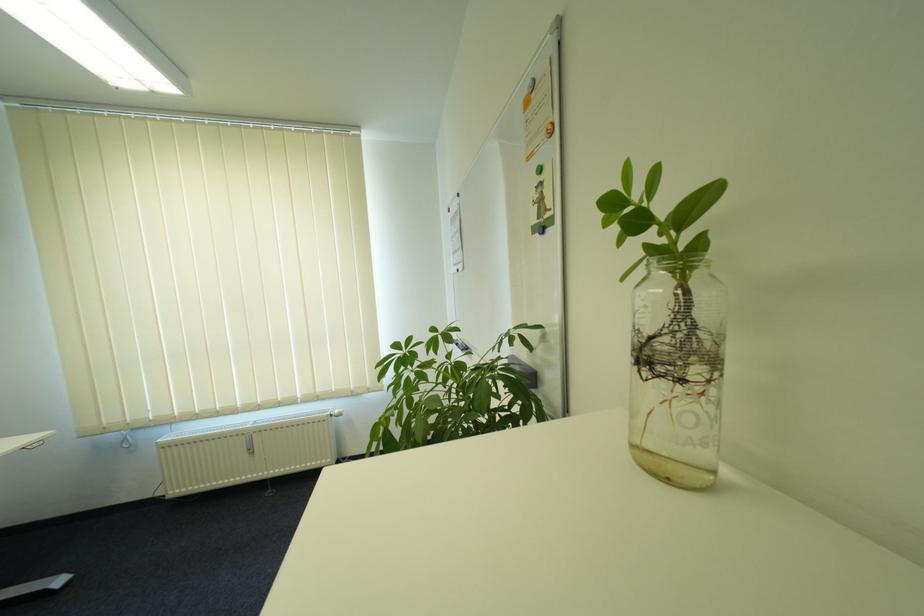
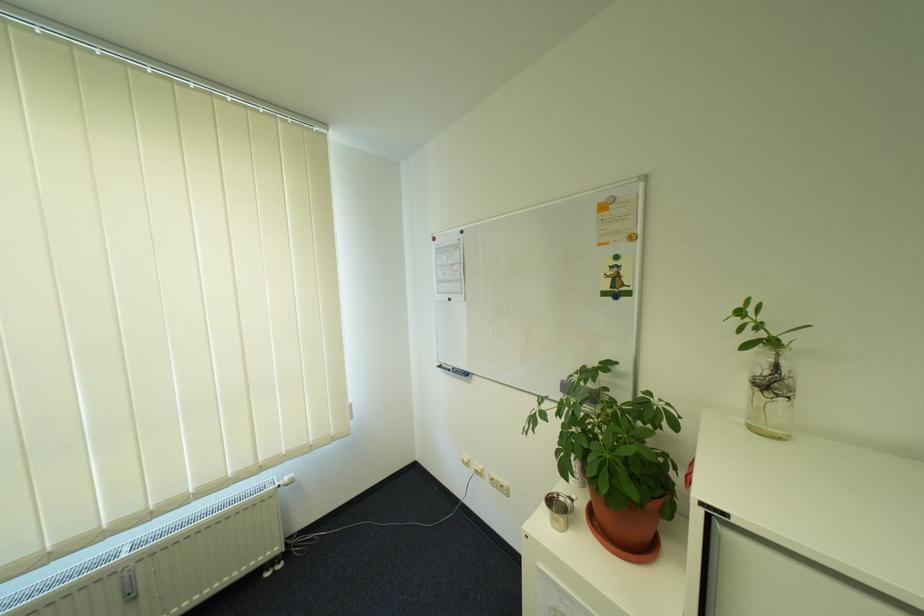
Question: The images are taken continuously from a first-person perspective. In which direction are you moving?

Choices:
 (A) Left
 (B) Right
 (C) Forward
 (D) Backward

Answer: (A)